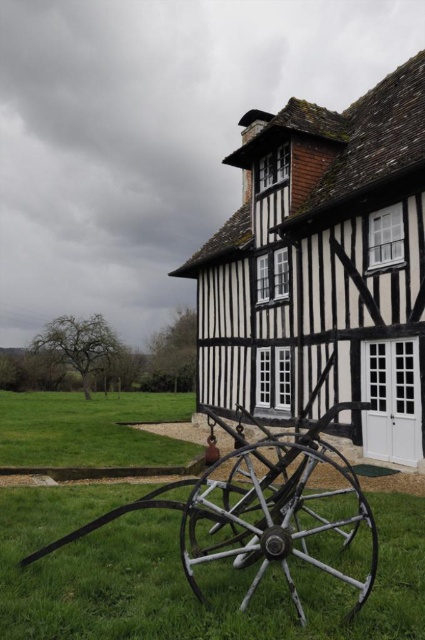
You are standing in front of the traditional half timbered building and see the point at coordinates [282,522]. What object is this point located on?

The point at coordinates [282,522] is located on the metallic silver wagon wheel at lower center.

You are a farmer standing at the base of the traditional half timbered building and you want to move from the metallic silver wagon wheel at lower center to the green grass at lower left. Can you walk directly between them without any obstacles?

The metallic silver wagon wheel at lower center and green grass at lower left are 60.78 feet apart from each other, so yes, you can walk directly between them without any obstacles since there is enough space.